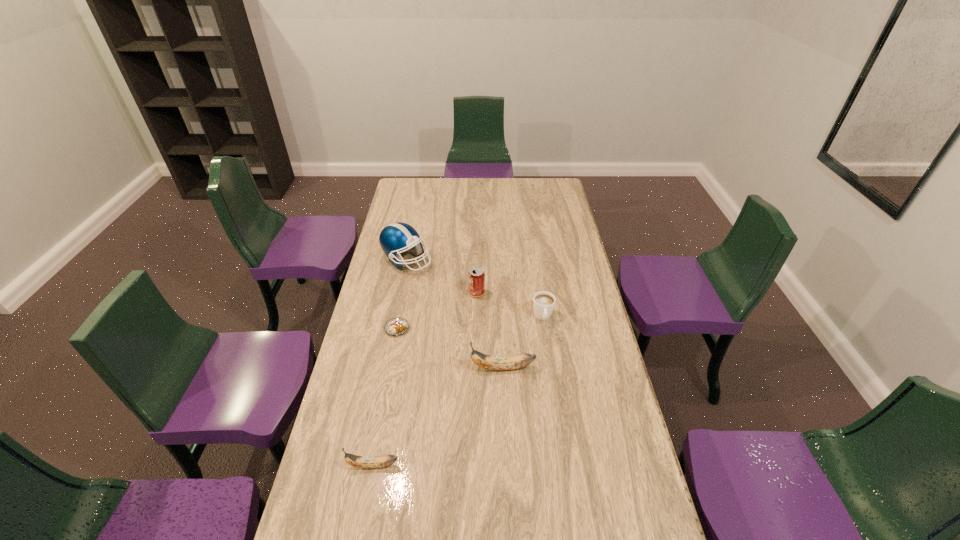
This screenshot has width=960, height=540. In order to click on vacant position at the near edge of the desktop in this screenshot , I will do `click(464, 514)`.

Identify the location of free space at the left edge. This screenshot has width=960, height=540. (394, 279).

The height and width of the screenshot is (540, 960). Identify the location of free space at the right edge of the desktop. (616, 415).

You are a GUI agent. You are given a task and a screenshot of the screen. Output one action in this format:
    pyautogui.click(x=<x>, y=<y>)
    Task: Click on the empty location between the fifth nearest object and the second nearest object
    
    Given the screenshot: What is the action you would take?
    pyautogui.click(x=490, y=330)

Where is `free space between the right banana and the football helmet`? The width and height of the screenshot is (960, 540). free space between the right banana and the football helmet is located at coordinates (454, 314).

Image resolution: width=960 pixels, height=540 pixels. I want to click on vacant area that lies between the tallest object and the second farthest object, so click(442, 276).

Find the location of a particular element. vacant point located between the shortest object and the football helmet is located at coordinates (402, 294).

The height and width of the screenshot is (540, 960). I want to click on vacant region between the right banana and the shorter banana, so coord(438,416).

Find the location of a particular element. free spot between the soda can and the fifth farthest object is located at coordinates (490, 330).

Find the location of a particular element. empty space that is in between the shorter banana and the taller banana is located at coordinates (438, 416).